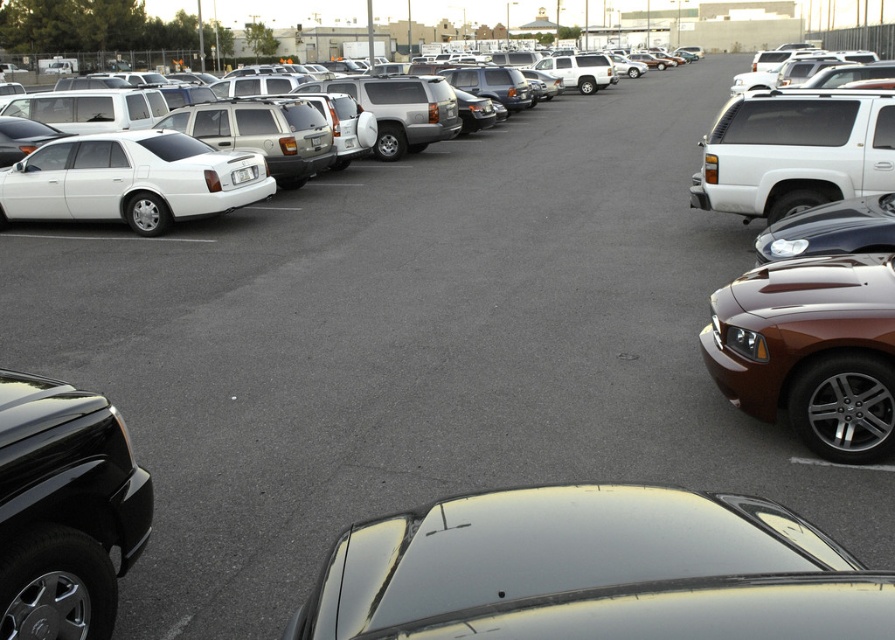
You are standing at the point marked at (576, 536) in the parking lot. You want to walk to the entrance of the parking lot, which is located at the opposite end from where you are. The entrance is 10 meters away from your current position. Can you reach the entrance without crossing any parked vehicles?

The entrance is 10 meters away from your current position at point (576, 536). Since the parking lot vehicles are parked in neat rows with spaces between them, you can navigate around them to reach the entrance without crossing any parked vehicles.

Based on the photo, you are driving a car and need to exit the parking lot. You see the white matte suv at right and the matte white sedan at left. Which vehicle is blocking your path?

The white matte suv at right is positioned over the matte white sedan at left, so the white matte suv at right is blocking your path.